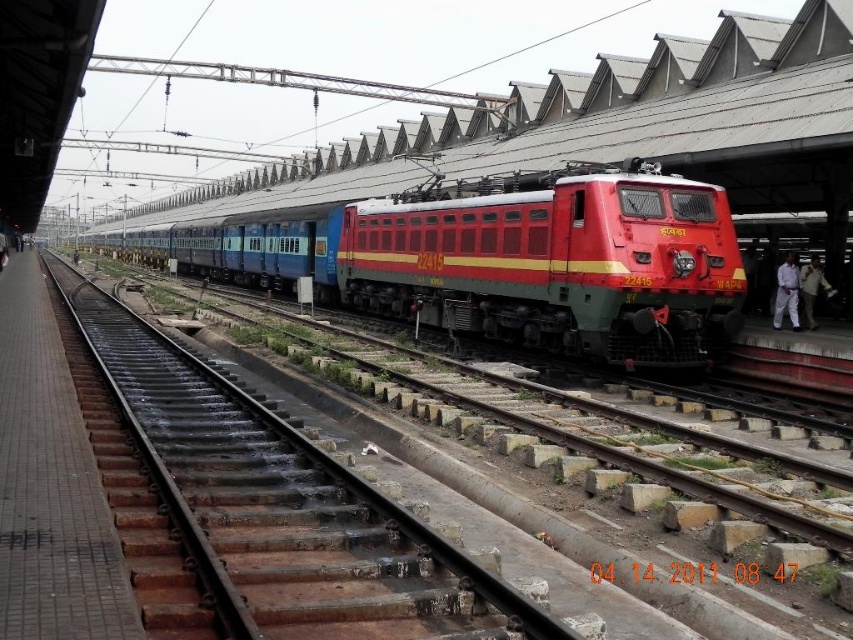
Between point (206, 269) and point (386, 529), which one is positioned behind?

The point (206, 269) is more distant.

From the picture: Who is higher up, shiny red locomotive at center or metal train track at center?

shiny red locomotive at center is above.

Image resolution: width=853 pixels, height=640 pixels. Describe the element at coordinates (497, 260) in the screenshot. I see `shiny red locomotive at center` at that location.

The width and height of the screenshot is (853, 640). In order to click on shiny red locomotive at center in this screenshot , I will do `click(497, 260)`.